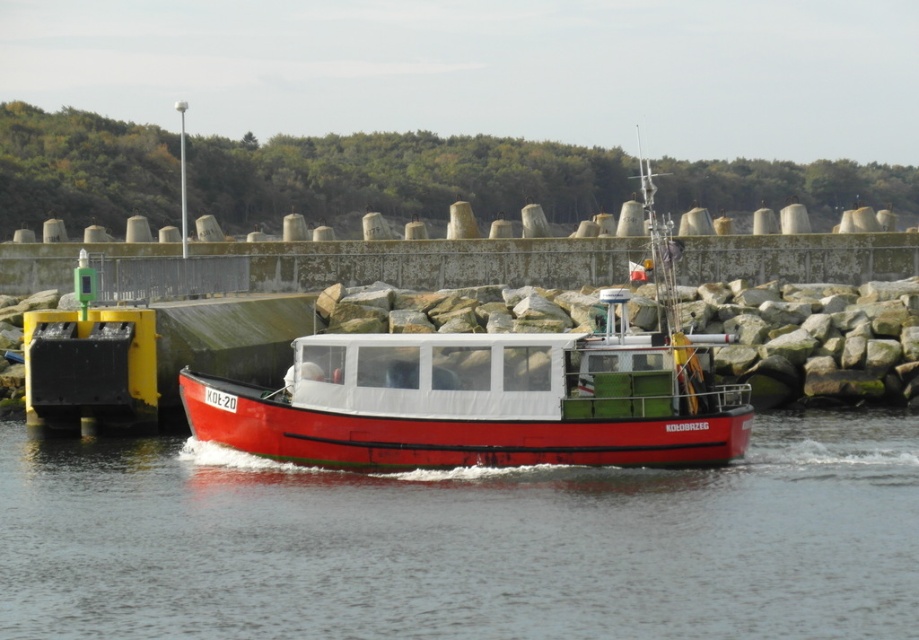
Question: Where is smooth water at boat right located in relation to matte red boat at center in the image?

Choices:
 (A) below
 (B) above

Answer: (A)

Question: Can you confirm if smooth water at boat right is positioned to the left of matte red boat at center?

Choices:
 (A) yes
 (B) no

Answer: (A)

Question: Among these points, which one is nearest to the camera?

Choices:
 (A) (176, 586)
 (B) (319, 460)

Answer: (A)

Question: Does smooth water at boat right appear on the right side of matte red boat at center?

Choices:
 (A) no
 (B) yes

Answer: (A)